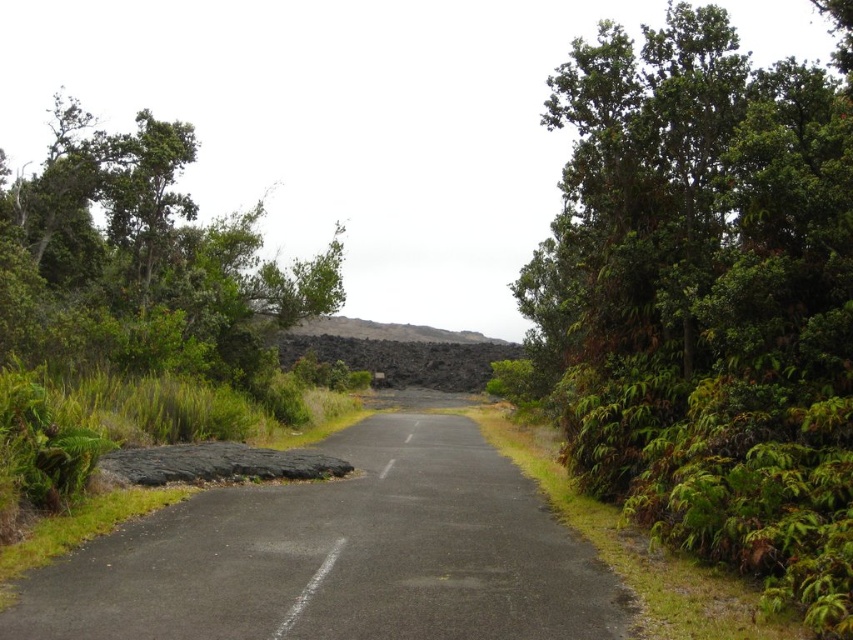
You are a driver approaching the road and see the green leafy tree at right and the green leafy tree at left. Which tree would block your view more if you are driving along the road?

The green leafy tree at right would block your view more because it is taller than the green leafy tree at left.